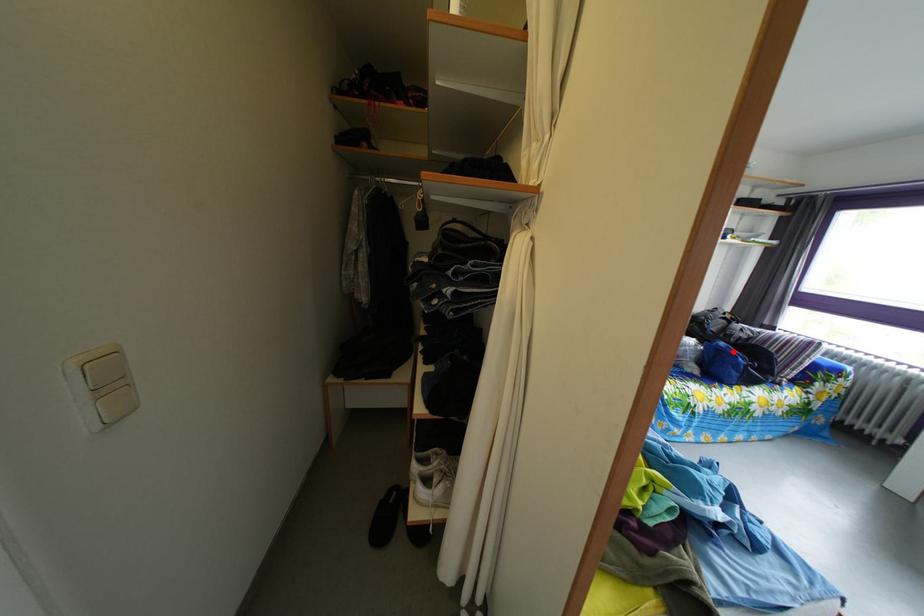
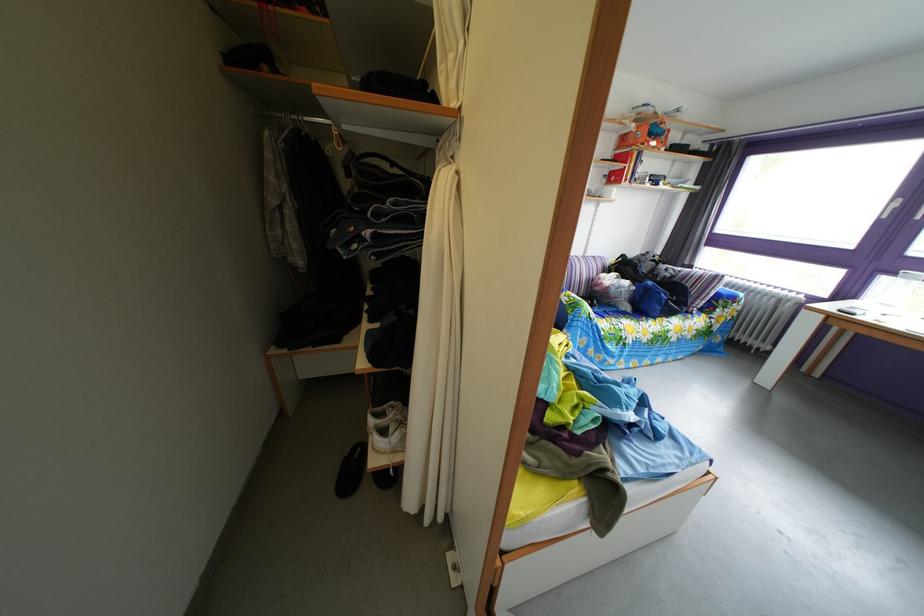
Locate, in the second image, the point that corresponds to the highlighted location in the first image.

(661, 291)